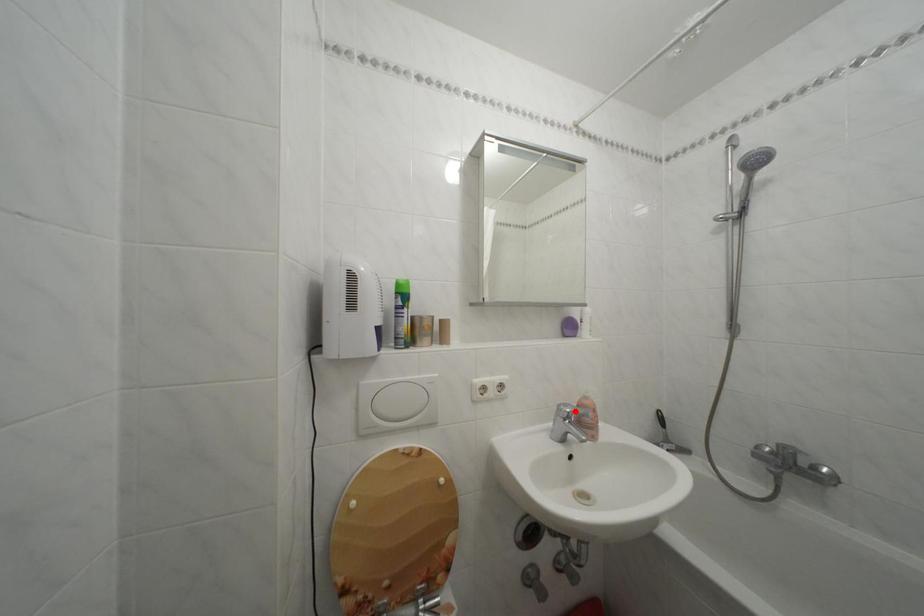
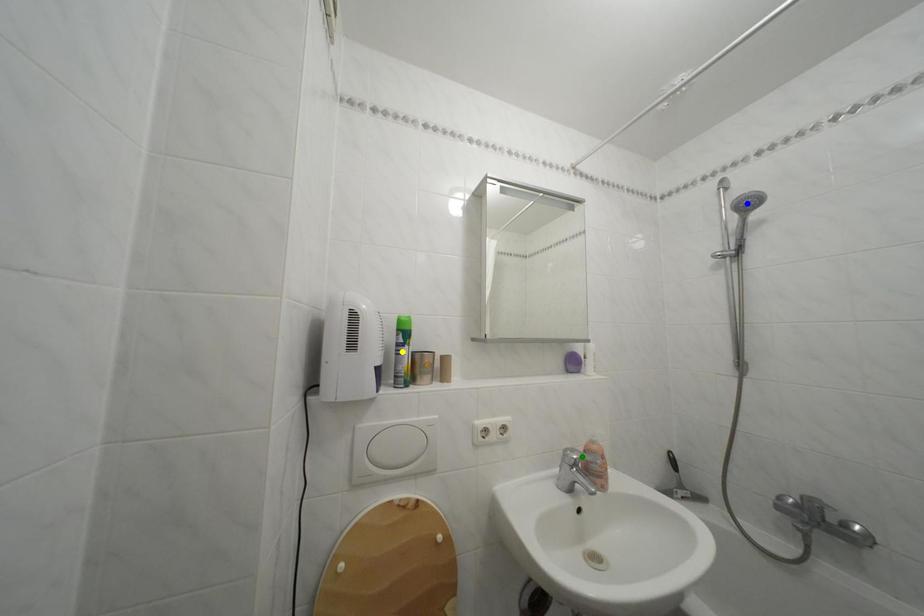
Question: I am providing you with two images of the same scene from different viewpoints. A red point is marked on the first image. You are given multiple points on the second image. Which point in image 2 is actually the same real-world point as the red point in image 1?

Choices:
 (A) green point
 (B) blue point
 (C) yellow point

Answer: (A)